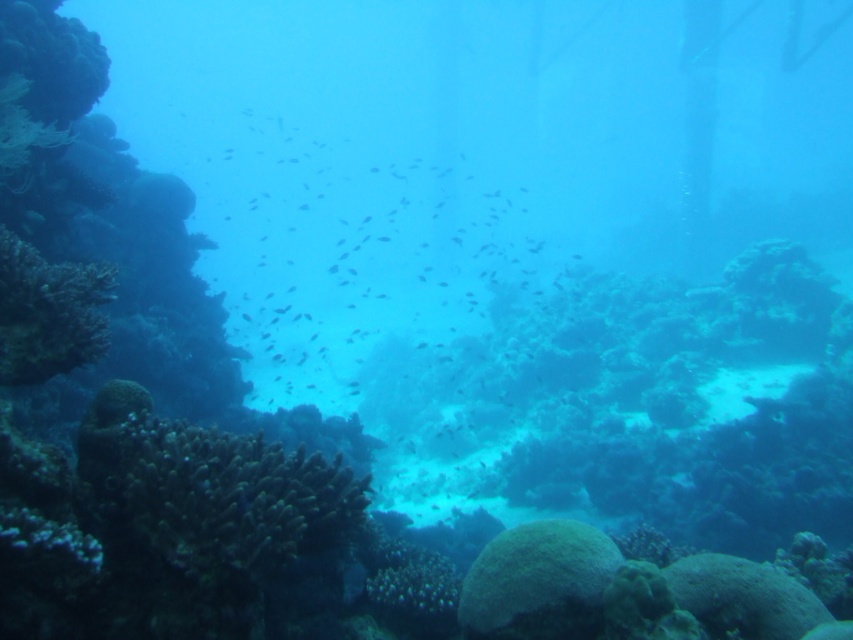
You are a marine biologist observing an underwater scene. You notice a dark blue matte fish at center and a green matte coral at lower left. Based on their positions, which object is closer to the surface of the water?

The dark blue matte fish at center is located above the green matte coral at lower left, so it is closer to the surface of the water.

You are an underwater photographer aiming to capture a wide shot of both the dark blue matte fish at center and the green matte coral at lower left. Given their sizes, which object will appear larger in the photo?

The dark blue matte fish at center will appear larger in the photo because its width is larger than the green matte coral at lower left.